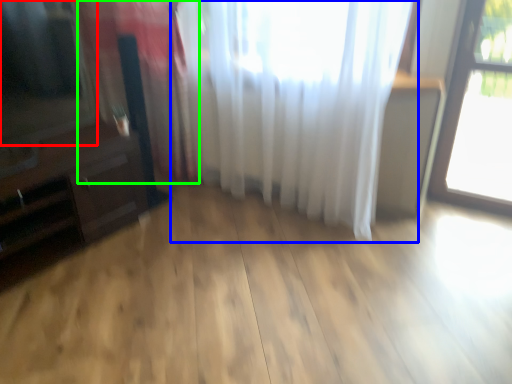
Question: Based on their relative distances, which object is farther from window screen (highlighted by a red box)? Choose from curtain (highlighted by a blue box) and curtain (highlighted by a green box).

Choices:
 (A) curtain
 (B) curtain

Answer: (A)